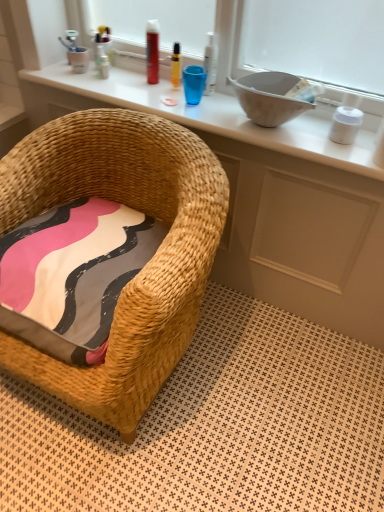
Find the location of `free space to the left of gray matte bowl at upper right`. free space to the left of gray matte bowl at upper right is located at coordinates (194, 108).